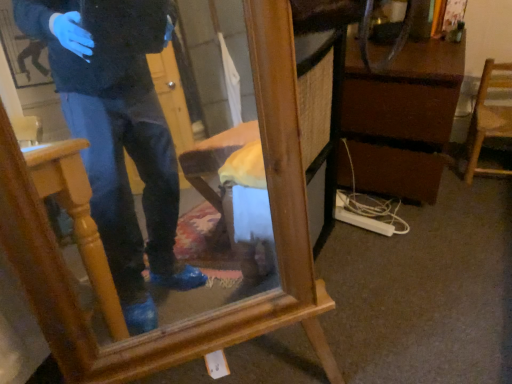
Question: Could brown wood vanity at center right be considered to be inside wooden chair at right?

Choices:
 (A) no
 (B) yes

Answer: (A)

Question: Is there a large distance between wooden chair at right and brown wood vanity at center right?

Choices:
 (A) no
 (B) yes

Answer: (A)

Question: Can you confirm if wooden chair at right is wider than brown wood vanity at center right?

Choices:
 (A) no
 (B) yes

Answer: (A)

Question: Is wooden chair at right in contact with brown wood vanity at center right?

Choices:
 (A) yes
 (B) no

Answer: (B)

Question: Considering the relative sizes of wooden chair at right and brown wood vanity at center right in the image provided, is wooden chair at right taller than brown wood vanity at center right?

Choices:
 (A) yes
 (B) no

Answer: (B)

Question: Looking at the image, does brown wood vanity at center right seem bigger or smaller compared to wooden chair at right?

Choices:
 (A) big
 (B) small

Answer: (A)

Question: Relative to wooden chair at right, is brown wood vanity at center right in front or behind?

Choices:
 (A) front
 (B) behind

Answer: (A)

Question: From a real-world perspective, is brown wood vanity at center right above or below wooden chair at right?

Choices:
 (A) below
 (B) above

Answer: (B)

Question: Is brown wood vanity at center right situated inside wooden chair at right or outside?

Choices:
 (A) outside
 (B) inside

Answer: (A)

Question: Considering the positions of wooden mirror at center and brown wood vanity at center right in the image, is wooden mirror at center bigger or smaller than brown wood vanity at center right?

Choices:
 (A) small
 (B) big

Answer: (B)

Question: Is wooden mirror at center wider or thinner than brown wood vanity at center right?

Choices:
 (A) thin
 (B) wide

Answer: (A)

Question: Considering the positions of point (249, 16) and point (436, 69), is point (249, 16) closer or farther from the camera than point (436, 69)?

Choices:
 (A) closer
 (B) farther

Answer: (A)

Question: From their relative heights in the image, would you say wooden mirror at center is taller or shorter than brown wood vanity at center right?

Choices:
 (A) short
 (B) tall

Answer: (B)

Question: In terms of width, does brown wood vanity at center right look wider or thinner when compared to wooden mirror at center?

Choices:
 (A) thin
 (B) wide

Answer: (B)

Question: In terms of size, does brown wood vanity at center right appear bigger or smaller than wooden mirror at center?

Choices:
 (A) small
 (B) big

Answer: (A)